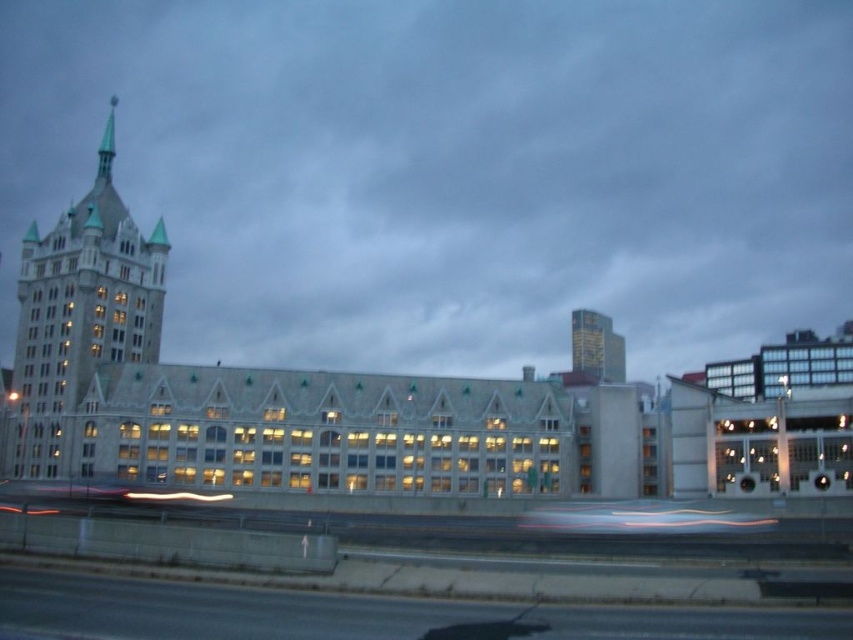
Does black asphalt highway at lower left appear on the left side of matte stone tower at upper left?

Incorrect, black asphalt highway at lower left is not on the left side of matte stone tower at upper left.

Can you confirm if black asphalt highway at lower left is positioned below matte stone tower at upper left?

Indeed, black asphalt highway at lower left is positioned under matte stone tower at upper left.

Is point (343, 605) in front of point (55, 476)?

Yes, point (343, 605) is in front of point (55, 476).

The image size is (853, 640). I want to click on black asphalt highway at lower left, so click(x=218, y=611).

Between matte stone tower at upper left and gold metallic building at upper right, which one appears on the right side from the viewer's perspective?

From the viewer's perspective, gold metallic building at upper right appears more on the right side.

Does matte stone tower at upper left appear over gold metallic building at upper right?

Correct, matte stone tower at upper left is located above gold metallic building at upper right.

In order to click on matte stone tower at upper left in this screenshot , I will do `click(78, 317)`.

Measure the distance between point [589,636] and camera.

The distance of point [589,636] from camera is 42.68 meters.

Is black asphalt highway at lower left closer to the viewer compared to gold metallic building at upper right?

Yes, black asphalt highway at lower left is closer to the viewer.

Which is in front, point (196, 611) or point (614, 337)?

Point (196, 611)

Where is `black asphalt highway at lower left`? Image resolution: width=853 pixels, height=640 pixels. black asphalt highway at lower left is located at coordinates (218, 611).